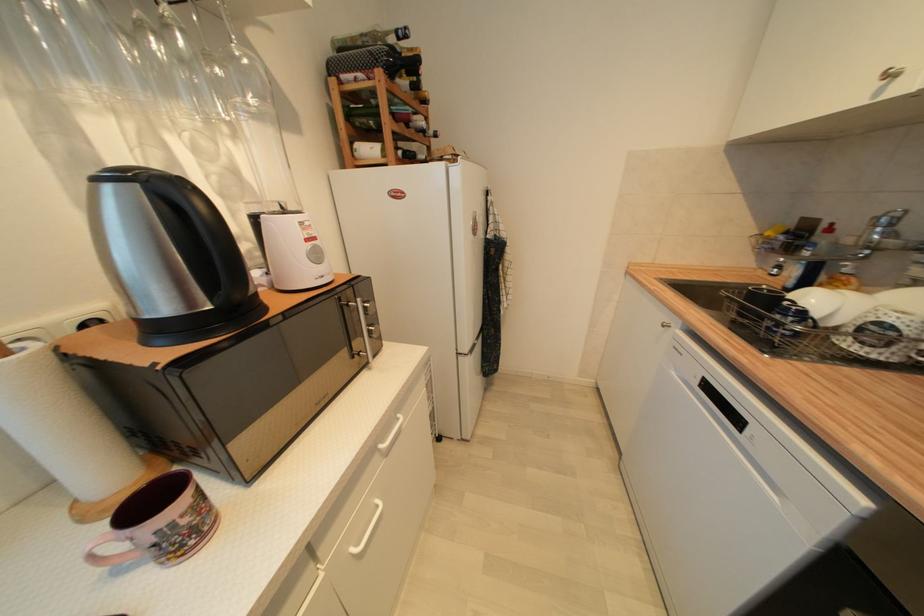
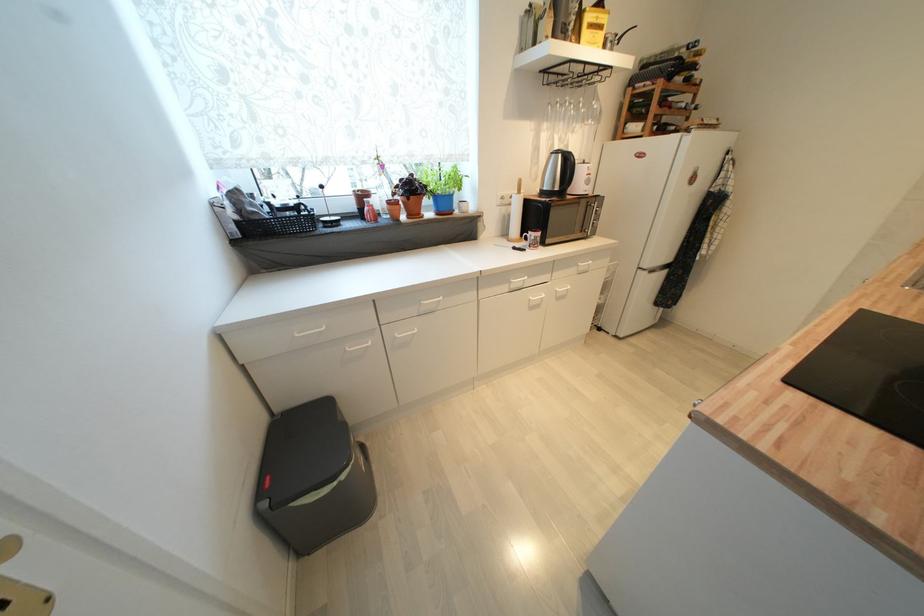
Where in the second image is the point corresponding to [442,156] from the first image?

(690, 127)